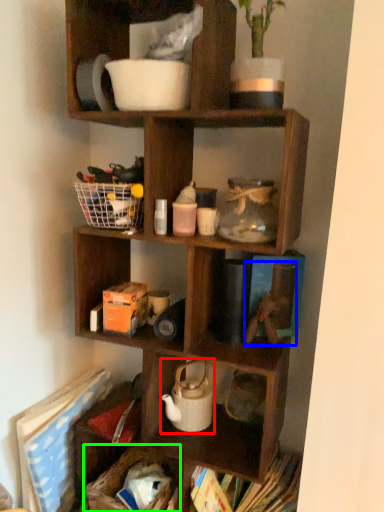
Question: Based on their relative distances, which object is farther from tea pot (highlighted by a red box)? Choose from toy (highlighted by a blue box) and basket (highlighted by a green box).

Choices:
 (A) toy
 (B) basket

Answer: (A)